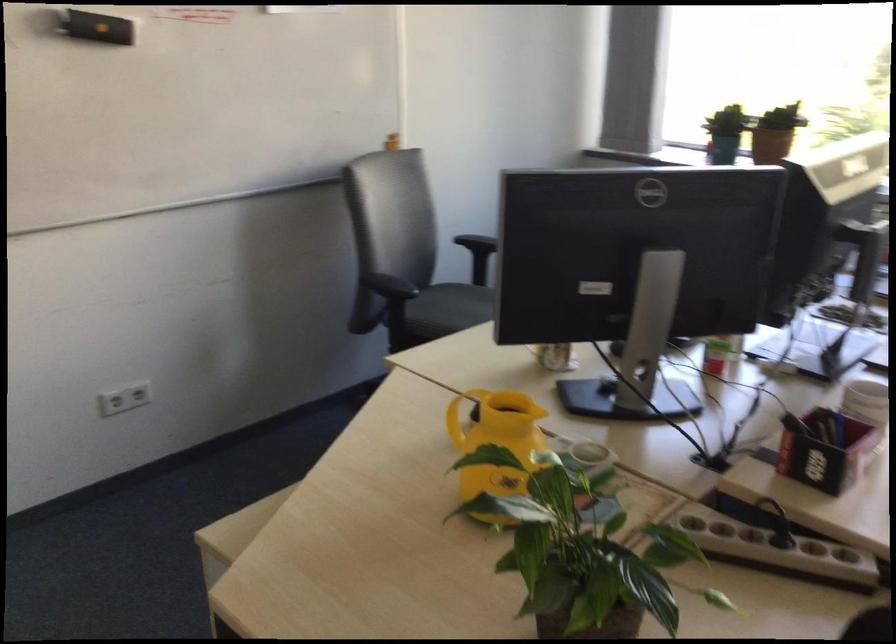
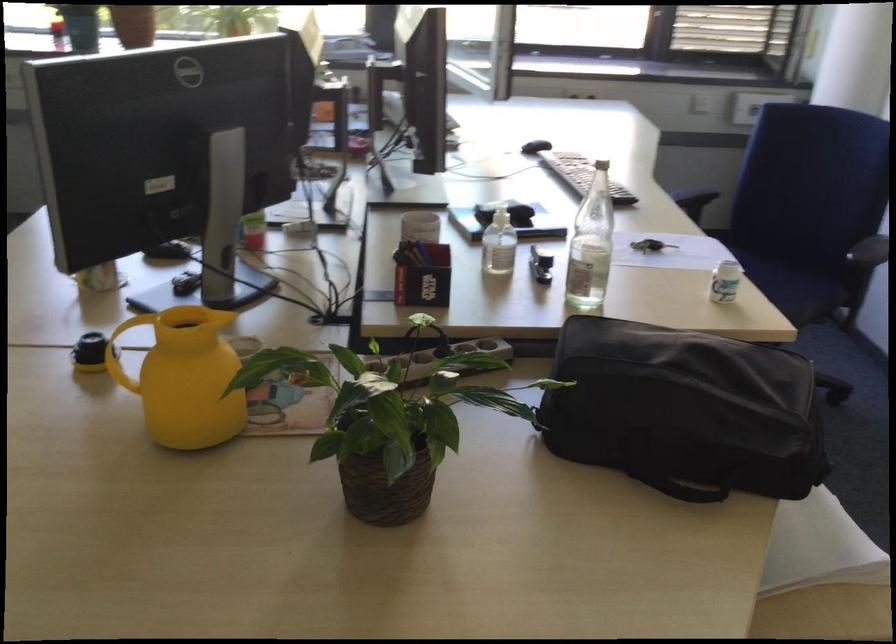
Where in the second image is the point corresponding to point (487, 450) from the first image?

(185, 377)